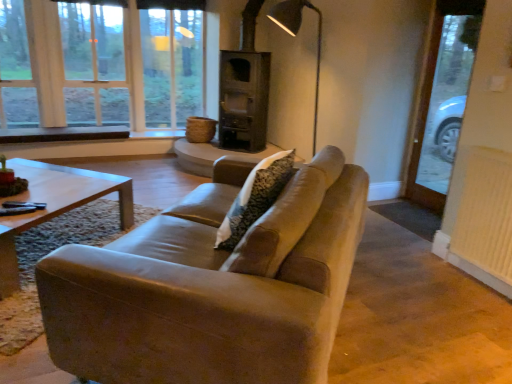
Where is `vacant space positioned to the left of white textured radiator at right`? vacant space positioned to the left of white textured radiator at right is located at coordinates (428, 273).